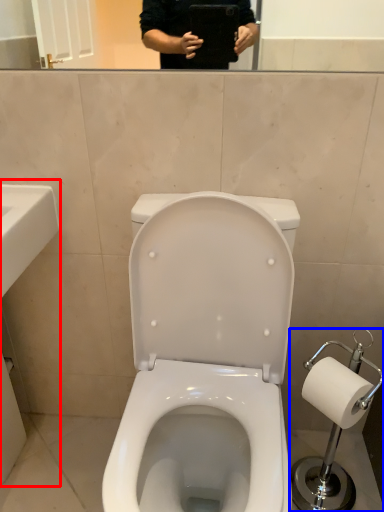
Question: Which of the following is the closest to the observer, sink (highlighted by a red box) or scale (highlighted by a blue box)?

Choices:
 (A) sink
 (B) scale

Answer: (A)